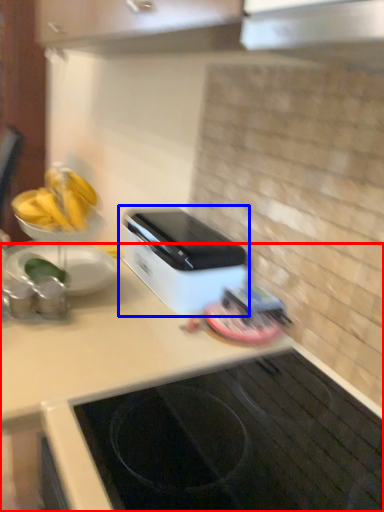
Question: Which of the following is the farthest to the observer, countertop (highlighted by a red box) or home appliance (highlighted by a blue box)?

Choices:
 (A) countertop
 (B) home appliance

Answer: (B)